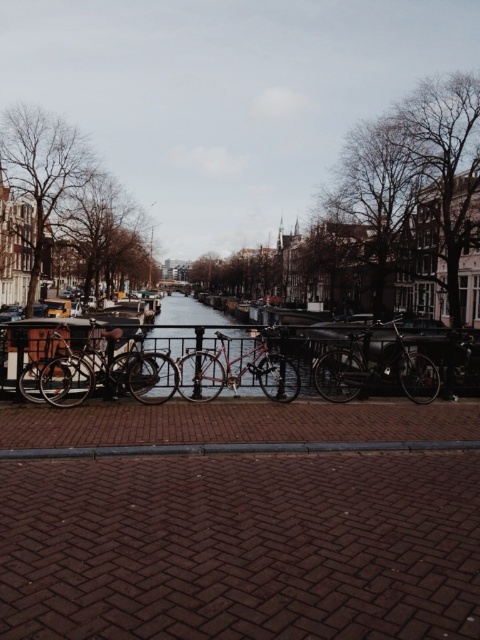
You are a delivery person who needs to cross the canal using a narrow bridge that is only as wide as the shiny red bicycle at center. Can you safely navigate your 1.5 meter wide delivery cart across the bridge without touching the metallic waterway at center?

The metallic waterway at center is wider than the shiny red bicycle at center. Since the bridge is as wide as the bicycle, the delivery cart which is 1.5 meters wide may not fit safely if the bicycle is narrower than the waterway. However, without exact measurements, it is uncertain. Please check the actual width of the bridge before proceeding.

You are standing at the edge of the canal and want to take a photo of both the point at coordinates (418,387) and the point at coordinates (225,360). Which point will appear closer to the bottom of your camera viewfinder?

Point (225,360) will appear closer to the bottom of the camera viewfinder because it is closer to the camera than point (418,387).

You are a tourist standing on the paved brick walkway in the urban canal scene. You want to take a photo that includes both the metallic waterway at center and the shiny metallic bicycle at center. Since you want the bicycle to appear larger in the photo than the waterway, where should you position yourself relative to them?

To make the shiny metallic bicycle at center appear larger than the metallic waterway at center in your photo, you should move closer to the shiny metallic bicycle at center since it is shorter than the waterway. By positioning yourself closer to the bicycle, its size in the frame will increase relative to the waterway.